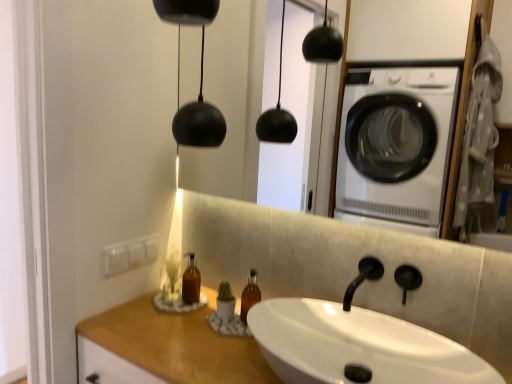
The width and height of the screenshot is (512, 384). Find the location of `free space in front of translucent amber bottle at center`. free space in front of translucent amber bottle at center is located at coordinates (175, 329).